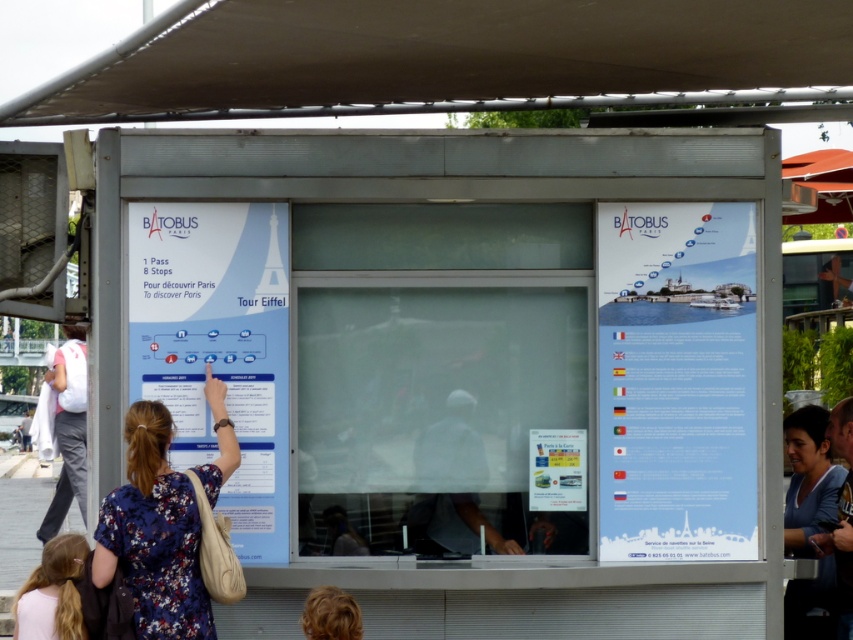
Question: Which point is farther to the camera?

Choices:
 (A) (85, 428)
 (B) (196, 246)
 (C) (355, 604)
 (D) (566, 483)

Answer: (A)

Question: Among these points, which one is nearest to the camera?

Choices:
 (A) (492, 540)
 (B) (167, 481)
 (C) (202, 212)
 (D) (849, 557)

Answer: (B)

Question: Can you confirm if blue floral dress at lower left is positioned to the left of gray fabric hat at center?

Choices:
 (A) yes
 (B) no

Answer: (A)

Question: Does dark blue shirt at center appear on the right side of blonde hair at lower center?

Choices:
 (A) no
 (B) yes

Answer: (B)

Question: Can you confirm if blue floral dress at lower left is bigger than dark blue shirt at center?

Choices:
 (A) yes
 (B) no

Answer: (A)

Question: Which of these objects is positioned farthest from the matte plastic ticket at center?

Choices:
 (A) blue fabric shirt at center
 (B) white fabric at left
 (C) gray fabric hat at center

Answer: (B)